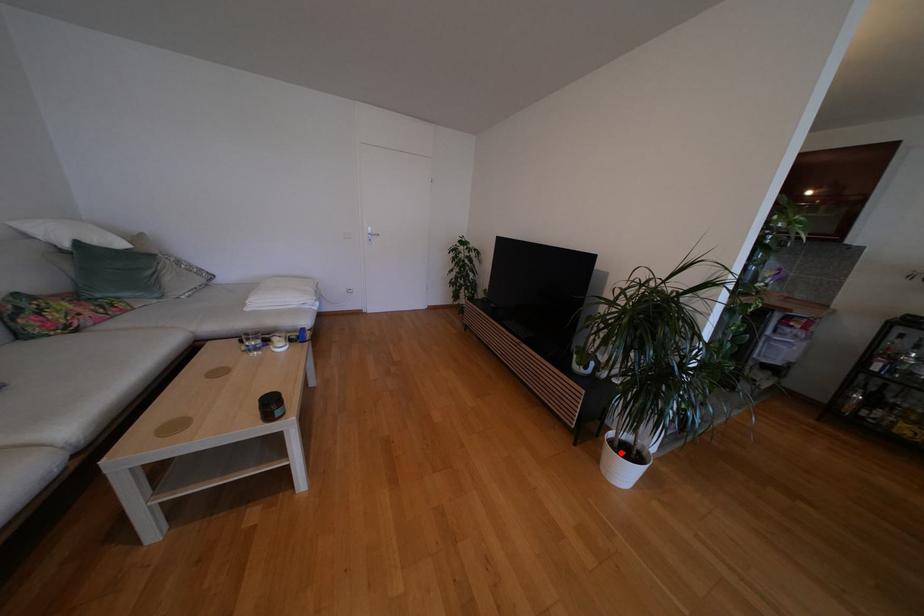
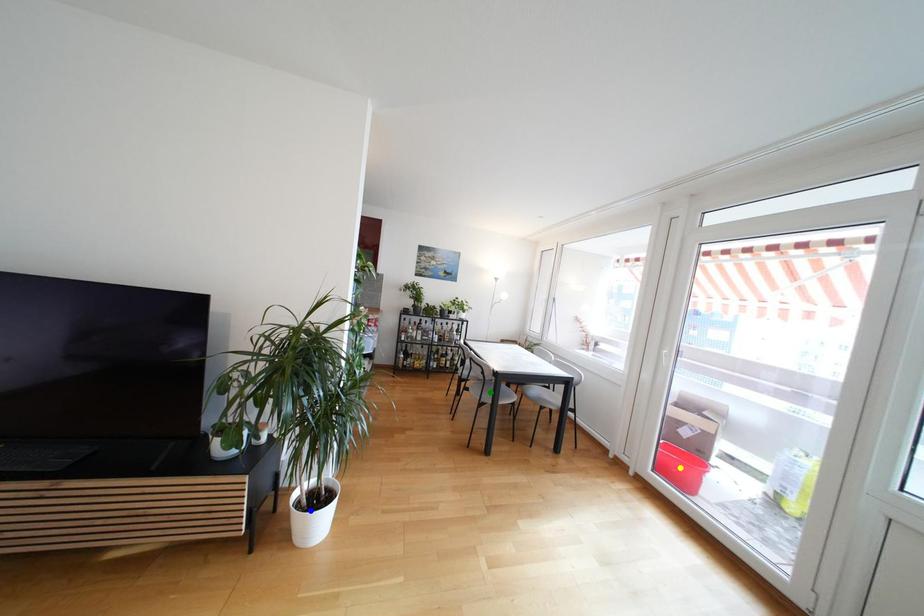
Question: I am providing you with two images of the same scene from different viewpoints. A red point is marked on the first image. You are given multiple points on the second image. Which mark in image 2 goes with the point in image 1?

Choices:
 (A) blue point
 (B) green point
 (C) yellow point

Answer: (A)